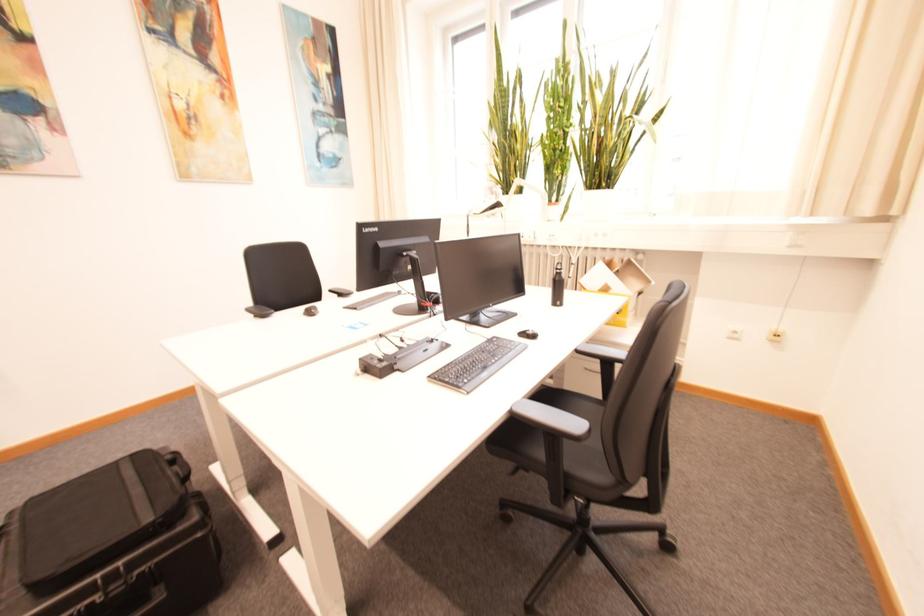
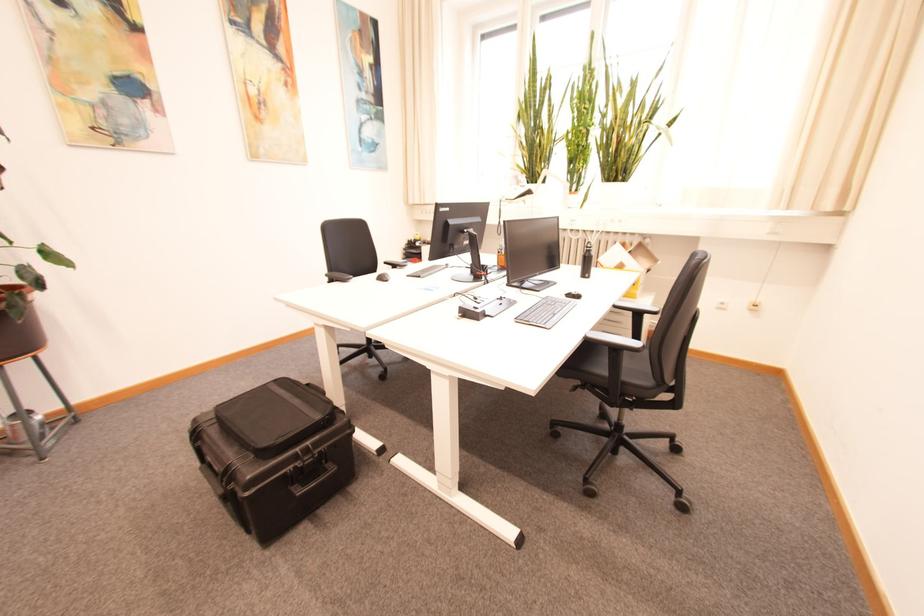
Question: I am providing you with two images of the same scene from different viewpoints. After the viewpoint changes to image2, which objects are now occluded?

Choices:
 (A) black bag handle
 (B) chair sitting surface
 (C) black keyboard
 (D) none of these

Answer: (D)